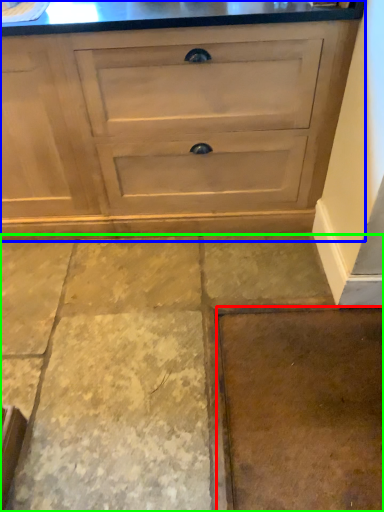
Question: Based on their relative distances, which object is nearer to concrete (highlighted by a red box)? Choose from chest of drawers (highlighted by a blue box) and concrete (highlighted by a green box).

Choices:
 (A) chest of drawers
 (B) concrete

Answer: (B)